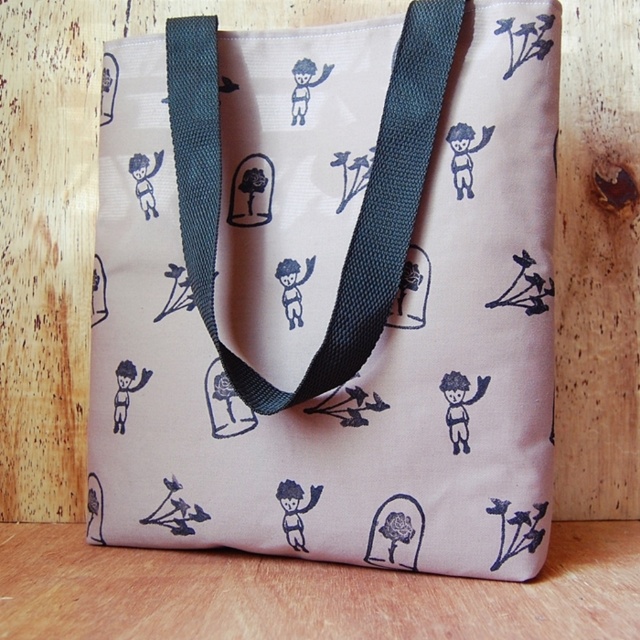
The image size is (640, 640). I want to click on pink fabric tote at center, so click(330, 289).

This screenshot has width=640, height=640. What are the coordinates of `pink fabric tote at center` in the screenshot? It's located at (330, 289).